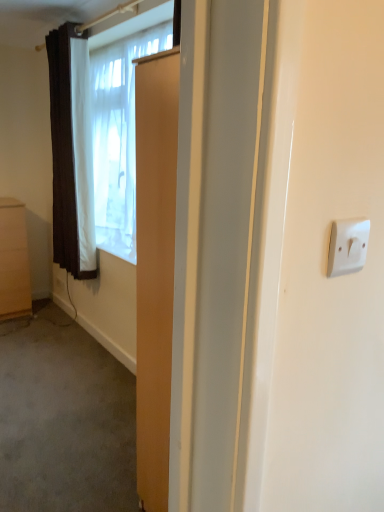
Question: Is matte brown cabinet at left at the back of white sheer curtain at upper left?

Choices:
 (A) no
 (B) yes

Answer: (A)

Question: From the image's perspective, is white sheer curtain at upper left under matte brown cabinet at left?

Choices:
 (A) no
 (B) yes

Answer: (A)

Question: Would you consider white sheer curtain at upper left to be distant from matte brown cabinet at left?

Choices:
 (A) no
 (B) yes

Answer: (A)

Question: Is white sheer curtain at upper left thinner than matte brown cabinet at left?

Choices:
 (A) no
 (B) yes

Answer: (B)

Question: From a real-world perspective, is white sheer curtain at upper left located beneath matte brown cabinet at left?

Choices:
 (A) yes
 (B) no

Answer: (B)

Question: Is white sheer curtain at upper left behind matte brown cabinet at left?

Choices:
 (A) yes
 (B) no

Answer: (B)

Question: Does matte brown cabinet at left have a smaller size compared to brown textured curtain at left?

Choices:
 (A) yes
 (B) no

Answer: (A)

Question: Considering the relative positions of matte brown cabinet at left and brown textured curtain at left in the image provided, is matte brown cabinet at left in front of brown textured curtain at left?

Choices:
 (A) no
 (B) yes

Answer: (A)

Question: Is matte brown cabinet at left not within brown textured curtain at left?

Choices:
 (A) yes
 (B) no

Answer: (A)

Question: Is matte brown cabinet at left at the left side of brown textured curtain at left?

Choices:
 (A) no
 (B) yes

Answer: (B)

Question: Would you say brown textured curtain at left is part of matte brown cabinet at left's contents?

Choices:
 (A) yes
 (B) no

Answer: (B)

Question: Does matte brown cabinet at left have a lesser width compared to brown textured curtain at left?

Choices:
 (A) no
 (B) yes

Answer: (A)

Question: From the image's perspective, is brown textured curtain at left below white sheer curtain at upper left?

Choices:
 (A) no
 (B) yes

Answer: (A)